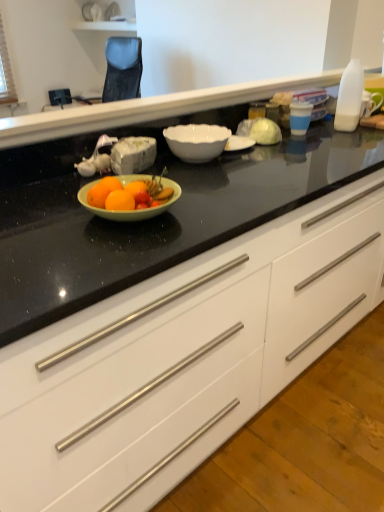
Question: Should I look upward or downward to see white glossy bowl at center?

Choices:
 (A) up
 (B) down

Answer: (A)

Question: Should I look upward or downward to see black glossy countertop at center?

Choices:
 (A) up
 (B) down

Answer: (A)

Question: Is black glossy countertop at center inside white glossy cabinet at center?

Choices:
 (A) yes
 (B) no

Answer: (B)

Question: From the image's perspective, would you say white glossy cabinet at center is shown under black glossy countertop at center?

Choices:
 (A) no
 (B) yes

Answer: (B)

Question: Would you say white glossy cabinet at center is a long distance from black glossy countertop at center?

Choices:
 (A) no
 (B) yes

Answer: (A)

Question: Is white glossy cabinet at center outside black glossy countertop at center?

Choices:
 (A) no
 (B) yes

Answer: (B)

Question: Is white glossy cabinet at center facing towards black glossy countertop at center?

Choices:
 (A) yes
 (B) no

Answer: (B)

Question: Is white glossy cabinet at center facing away from black glossy countertop at center?

Choices:
 (A) yes
 (B) no

Answer: (B)

Question: From the image's perspective, does white glossy bowl at center appear higher than white glossy cabinet at center?

Choices:
 (A) yes
 (B) no

Answer: (A)

Question: Is white glossy bowl at center surrounding white glossy cabinet at center?

Choices:
 (A) yes
 (B) no

Answer: (B)

Question: Would you say white glossy bowl at center is a long distance from white glossy cabinet at center?

Choices:
 (A) no
 (B) yes

Answer: (A)

Question: Is white glossy bowl at center further to camera compared to white glossy cabinet at center?

Choices:
 (A) no
 (B) yes

Answer: (B)

Question: Can you confirm if white glossy bowl at center is wider than white glossy cabinet at center?

Choices:
 (A) no
 (B) yes

Answer: (A)

Question: Does white glossy bowl at center touch white glossy cabinet at center?

Choices:
 (A) yes
 (B) no

Answer: (B)

Question: Can you confirm if white glossy bowl at center is positioned to the left of black glossy countertop at center?

Choices:
 (A) no
 (B) yes

Answer: (B)